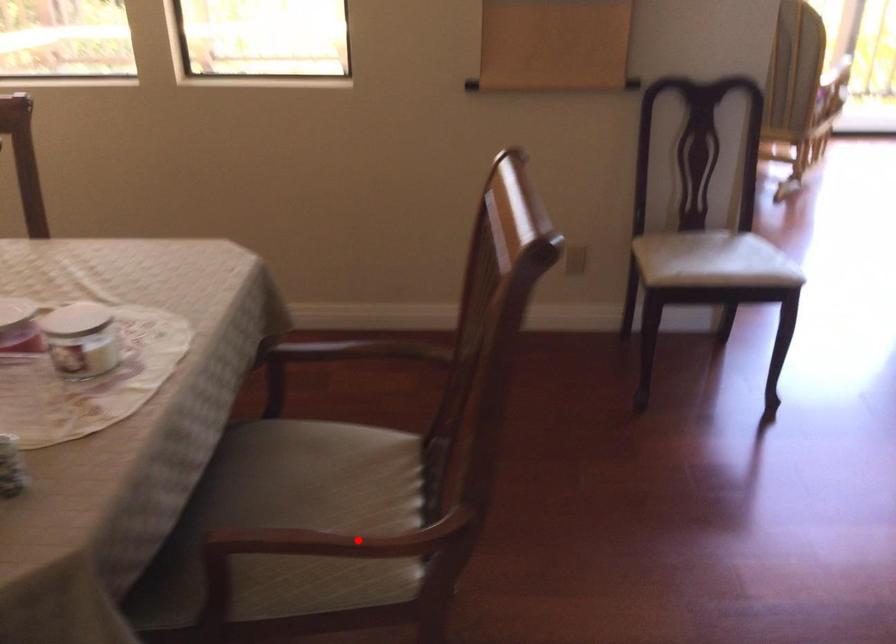
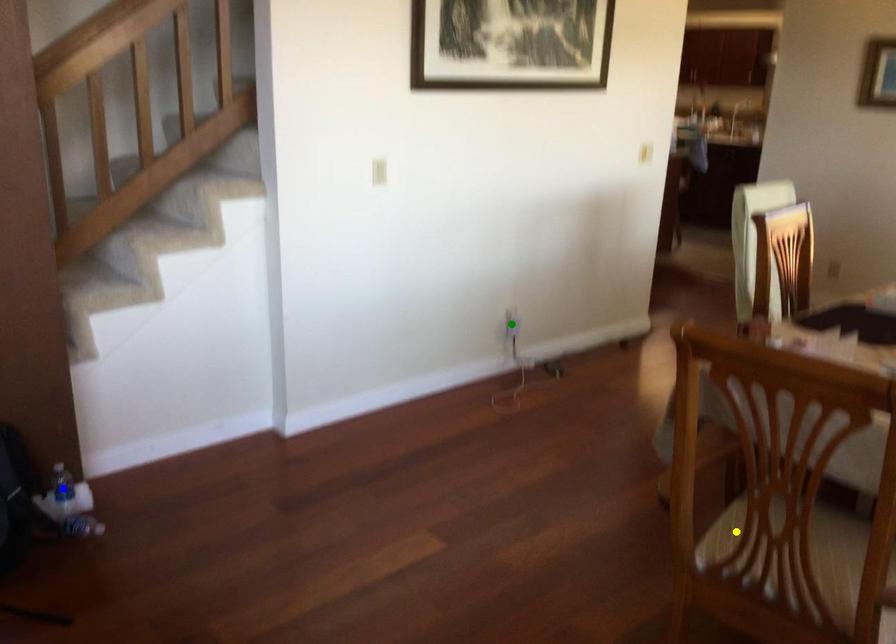
Question: I am providing you with two images of the same scene from different viewpoints. A red point is marked on the first image. You are given multiple points on the second image. Which spot in image 2 lines up with the point in image 1?

Choices:
 (A) green point
 (B) yellow point
 (C) blue point

Answer: (B)